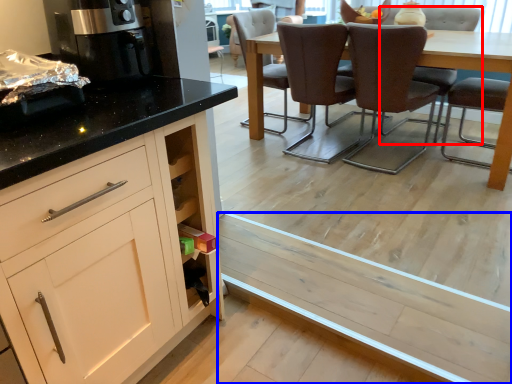
Question: Which point is closer to the camera, chair (highlighted by a red box) or plank (highlighted by a blue box)?

Choices:
 (A) chair
 (B) plank

Answer: (B)